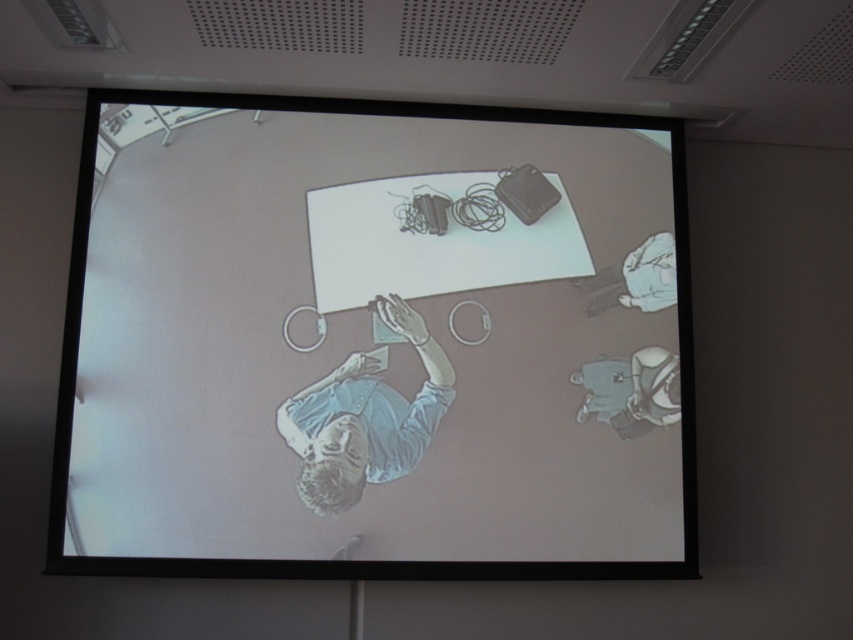
Does white glossy projector screen at upper center come behind smooth gray shirt at lower right?

No, it is not.

Is point (508, 115) less distant than point (646, 385)?

No.

Locate an element on the screen. white glossy projector screen at upper center is located at coordinates (363, 342).

Can you confirm if light blue fabric shirt at center is wider than white fabric shirt at upper right?

Indeed, light blue fabric shirt at center has a greater width compared to white fabric shirt at upper right.

Is point (340, 385) positioned after point (671, 264)?

No, (340, 385) is closer to viewer.

Measure the distance between light blue fabric shirt at center and camera.

light blue fabric shirt at center and camera are 2.34 meters apart.

At what (x,y) coordinates should I click in order to perform the action: click on light blue fabric shirt at center. Please return your answer as a coordinate pair (x, y). The width and height of the screenshot is (853, 640). Looking at the image, I should click on (364, 417).

Can you confirm if white glossy projector screen at upper center is taller than white fabric shirt at upper right?

Yes, white glossy projector screen at upper center is taller than white fabric shirt at upper right.

Does white glossy projector screen at upper center appear on the right side of white fabric shirt at upper right?

In fact, white glossy projector screen at upper center is to the left of white fabric shirt at upper right.

The width and height of the screenshot is (853, 640). In order to click on white glossy projector screen at upper center in this screenshot , I will do `click(363, 342)`.